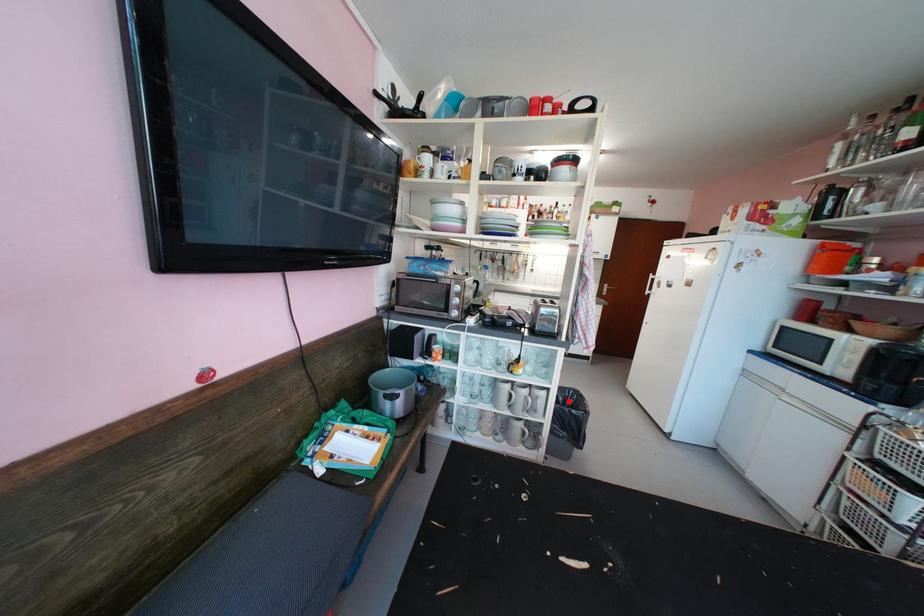
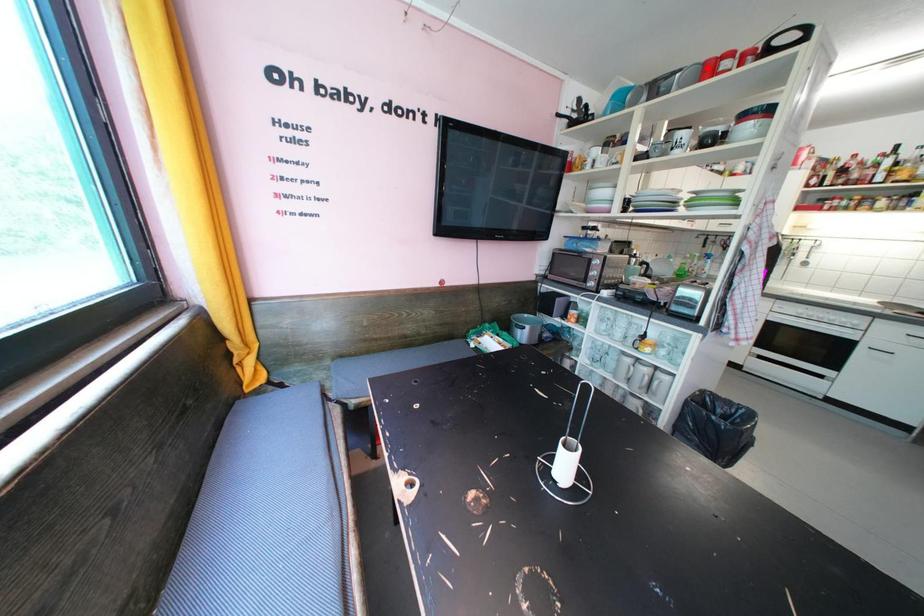
I am providing you with two images of the same scene from different viewpoints. A red point is marked on the first image and another point is marked on the second image. Are the points marked in image1 and image2 representing the same 3D position?

No